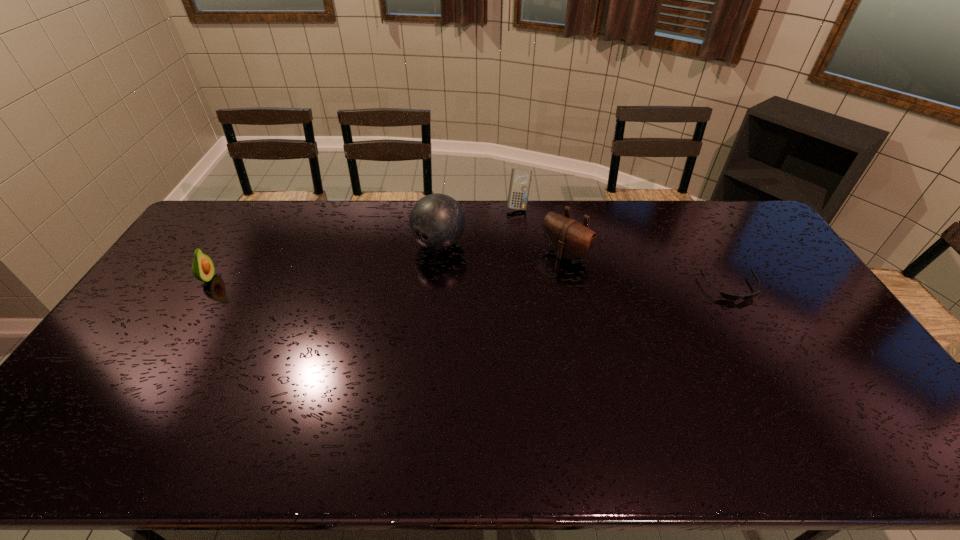
The width and height of the screenshot is (960, 540). Identify the location of vacant space on the desktop that is between the leftmost object and the shortest object and is positioned on the grip area of the bowling ball. click(x=396, y=282).

Locate an element on the screen. free space on the desktop that is between the leftmost object and the shortest object and is positioned on the front-facing side of the calculator is located at coordinates (525, 285).

Find the location of a particular element. The height and width of the screenshot is (540, 960). free space on the desktop that is between the leftmost object and the rightmost object and is positioned with the flap open on the pouch is located at coordinates (529, 285).